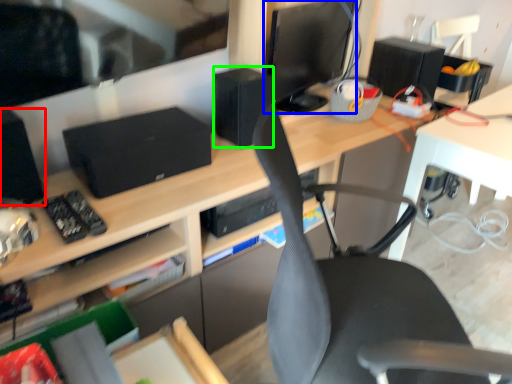
Question: Which object is positioned farthest from speaker (highlighted by a red box)? Select from computer monitor (highlighted by a blue box) and speaker (highlighted by a green box).

Choices:
 (A) computer monitor
 (B) speaker

Answer: (A)